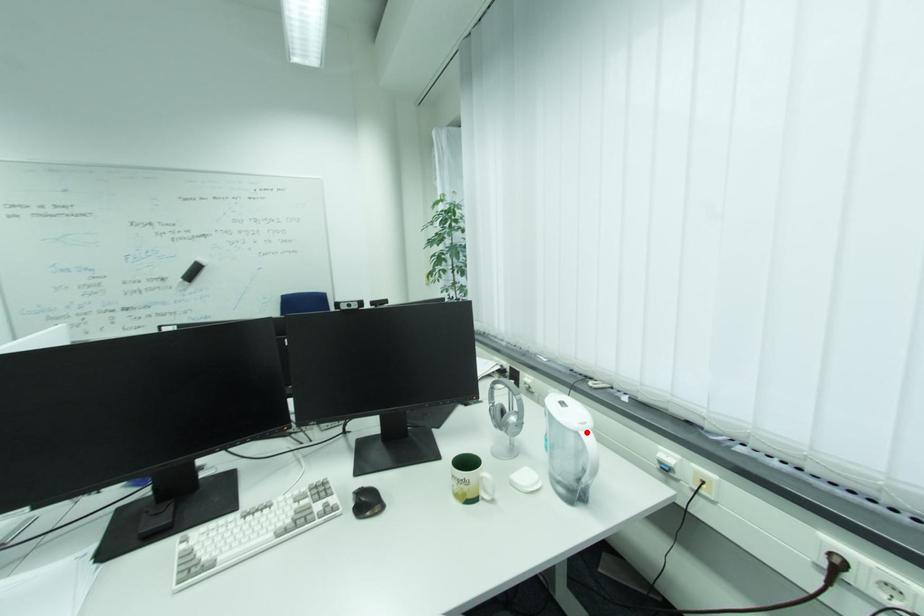
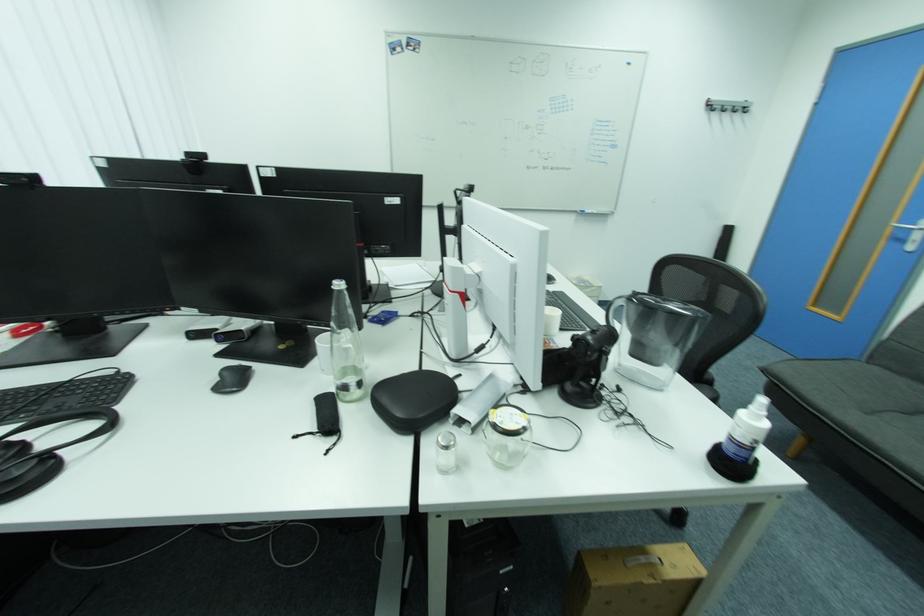
Question: I am providing you with two images of the same scene from different viewpoints. A red point is marked on the first image. Is the red point's position out of view in image 2?

Choices:
 (A) Yes
 (B) No

Answer: (A)